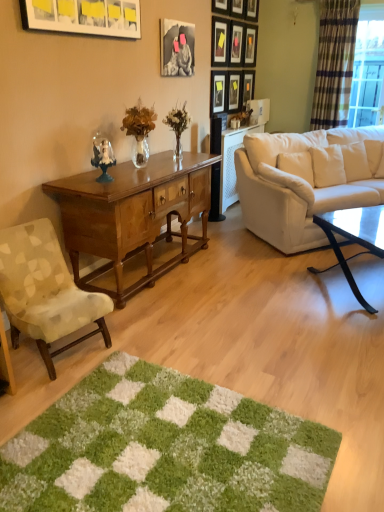
Where is `free space in front of light brown wood desk at center`? The image size is (384, 512). free space in front of light brown wood desk at center is located at coordinates (197, 336).